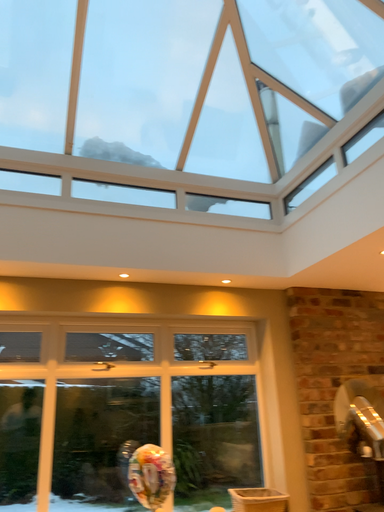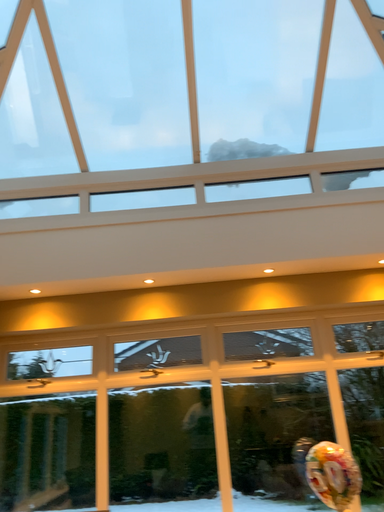
Question: How did the camera likely rotate when shooting the video?

Choices:
 (A) rotated right
 (B) rotated left

Answer: (B)